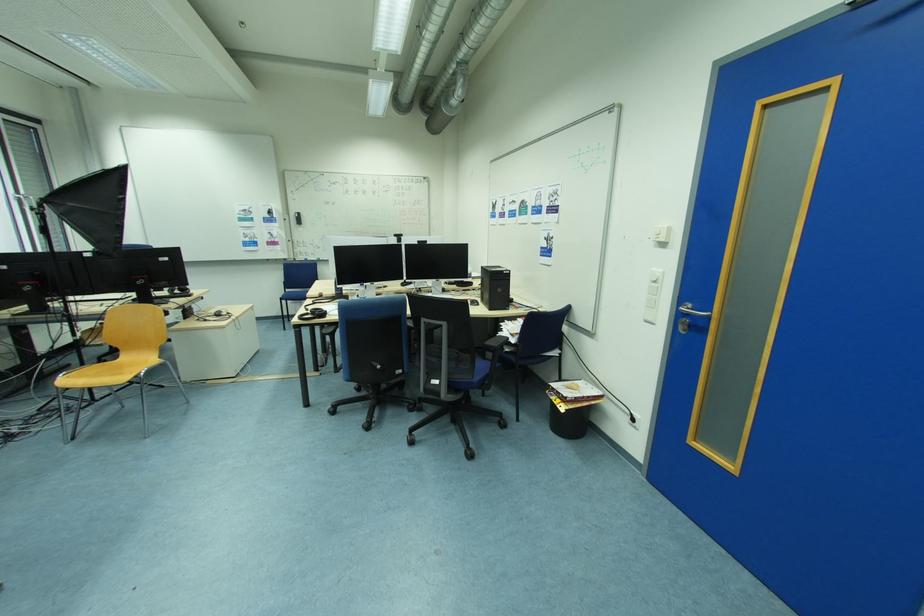
Describe the element at coordinates (661, 233) in the screenshot. This screenshot has width=924, height=616. I see `the white light switch` at that location.